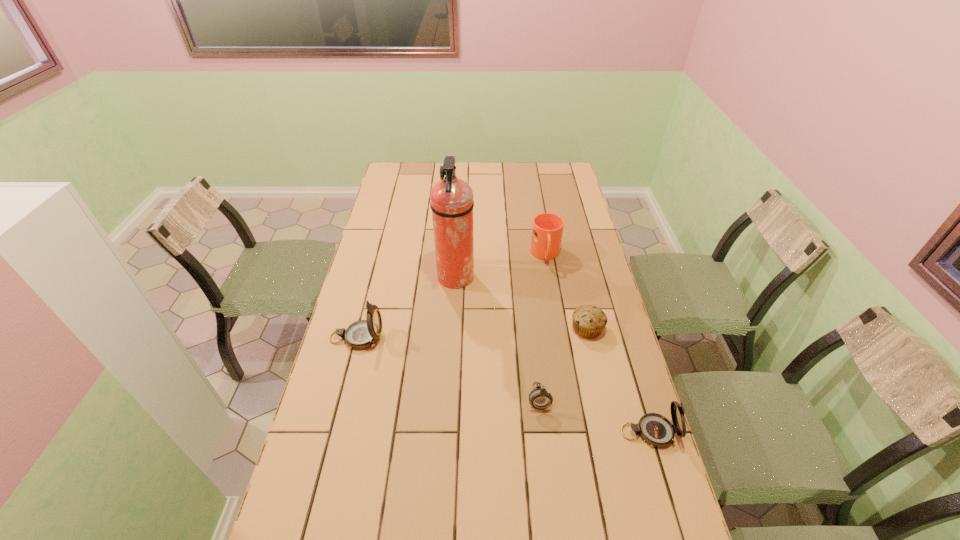
At what (x,y) coordinates should I click in order to perform the action: click on vacant space that satisfies the following two spatial constraints: 1. on the front side of the muffin; 2. on the face of the leftmost object. Please return your answer as a coordinate pair (x, y). The image size is (960, 540). Looking at the image, I should click on [589, 338].

At what (x,y) coordinates should I click in order to perform the action: click on vacant space that satisfies the following two spatial constraints: 1. on the front side of the muffin; 2. on the face of the farthest compass. Please return your answer as a coordinate pair (x, y). The width and height of the screenshot is (960, 540). Looking at the image, I should click on (589, 338).